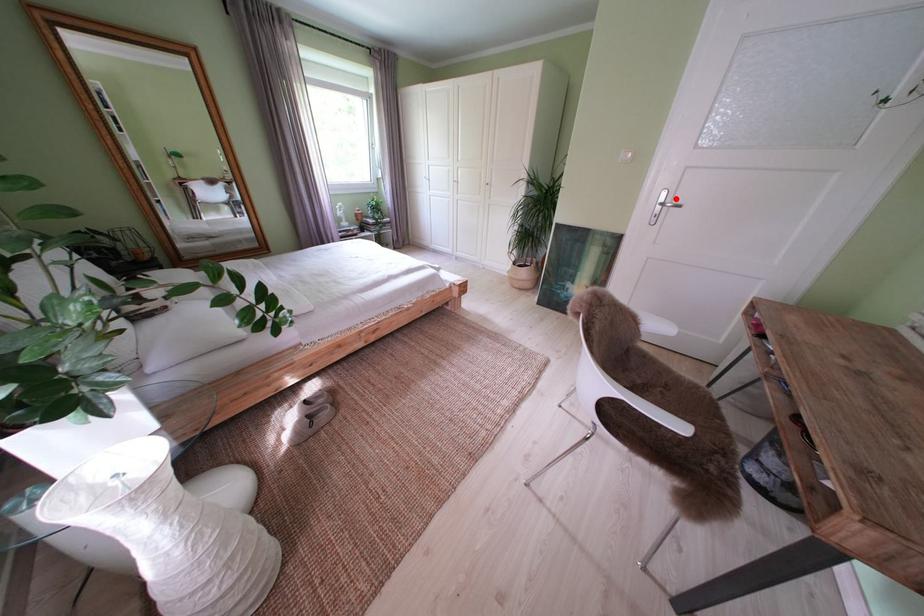
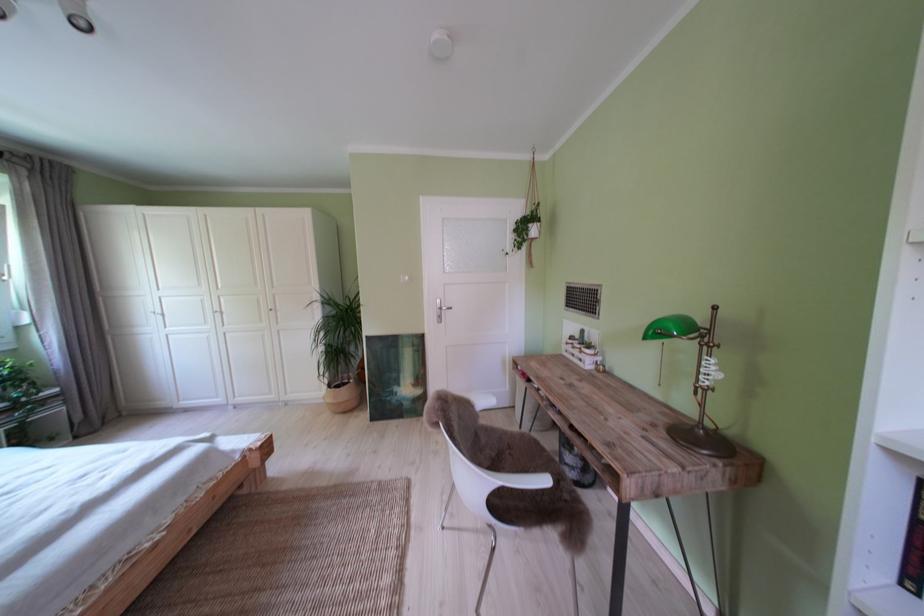
Find the pixel in the second image that matches the highlighted location in the first image.

(450, 307)